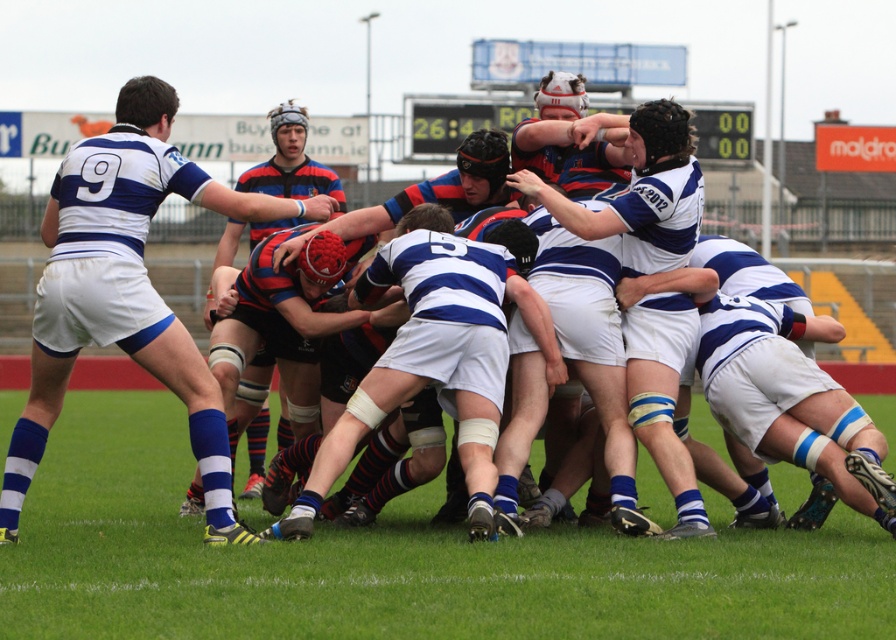
Question: Which point appears farthest from the camera in this image?

Choices:
 (A) (97, 216)
 (B) (294, 186)

Answer: (B)

Question: Which object is closer to the camera taking this photo?

Choices:
 (A) white matte jersey at center
 (B) striped jersey at center

Answer: (A)

Question: In this image, where is white matte jersey at center located relative to striped jersey at center?

Choices:
 (A) left
 (B) right

Answer: (B)

Question: Does white matte jersey at center have a larger size compared to striped jersey at center?

Choices:
 (A) no
 (B) yes

Answer: (A)

Question: Is the position of white matte jersey at center less distant than that of striped jersey at center?

Choices:
 (A) yes
 (B) no

Answer: (A)